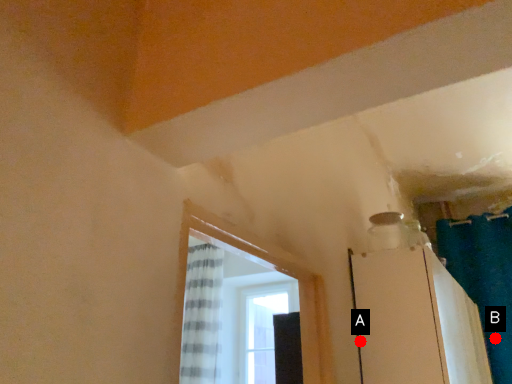
Question: Two points are circled on the image, labeled by A and B beside each circle. Which point is closer to the camera taking this photo?

Choices:
 (A) A is closer
 (B) B is closer

Answer: (A)